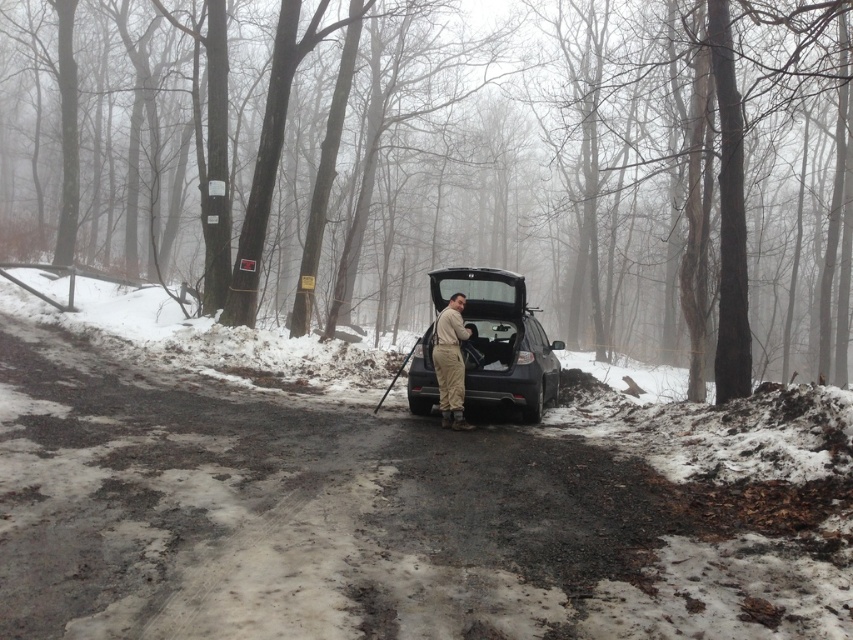
Where is `satin black suv at center`? Image resolution: width=853 pixels, height=640 pixels. satin black suv at center is located at coordinates (502, 339).

Is satin black suv at center to the left of tan fabric jumpsuit at center from the viewer's perspective?

Incorrect, satin black suv at center is not on the left side of tan fabric jumpsuit at center.

Identify the location of satin black suv at center. This screenshot has width=853, height=640. (502, 339).